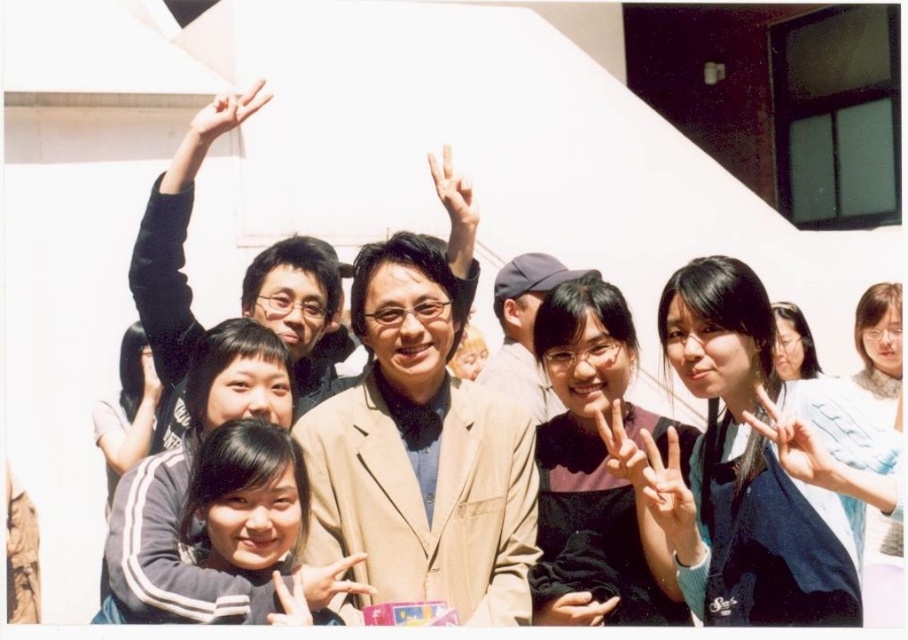
In the scene shown: Is beige fabric jacket at center below matte beige suit at center?

Yes, beige fabric jacket at center is below matte beige suit at center.

Is beige fabric jacket at center bigger than matte beige suit at center?

No, beige fabric jacket at center is not bigger than matte beige suit at center.

Image resolution: width=908 pixels, height=640 pixels. What are the coordinates of `beige fabric jacket at center` in the screenshot? It's located at (421, 452).

Describe the element at coordinates (421, 452) in the screenshot. The height and width of the screenshot is (640, 908). I see `beige fabric jacket at center` at that location.

Can you confirm if beige fabric jacket at center is smaller than light blue fabric hand at center right?

Correct, beige fabric jacket at center occupies less space than light blue fabric hand at center right.

At what (x,y) coordinates should I click in order to perform the action: click on beige fabric jacket at center. Please return your answer as a coordinate pair (x, y). This screenshot has height=640, width=908. Looking at the image, I should click on (421, 452).

Between light skin tone hand at center and matte black hand at center, which one has more height?

With more height is light skin tone hand at center.

Is point (659, 513) less distant than point (623, 461)?

Yes, point (659, 513) is closer to viewer.

The image size is (908, 640). Identify the location of light skin tone hand at center. (669, 493).